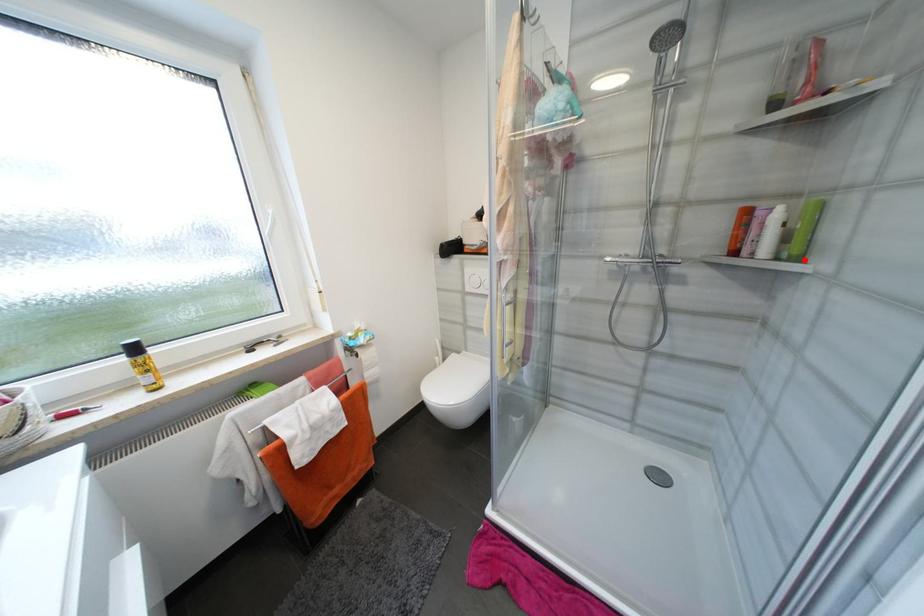
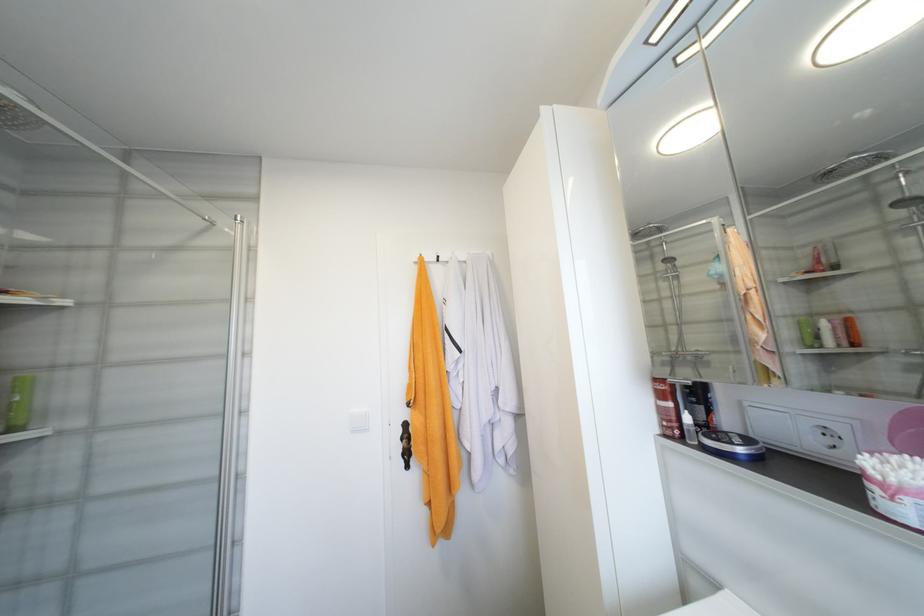
Find the pixel in the second image that matches the highlighted location in the first image.

(19, 430)